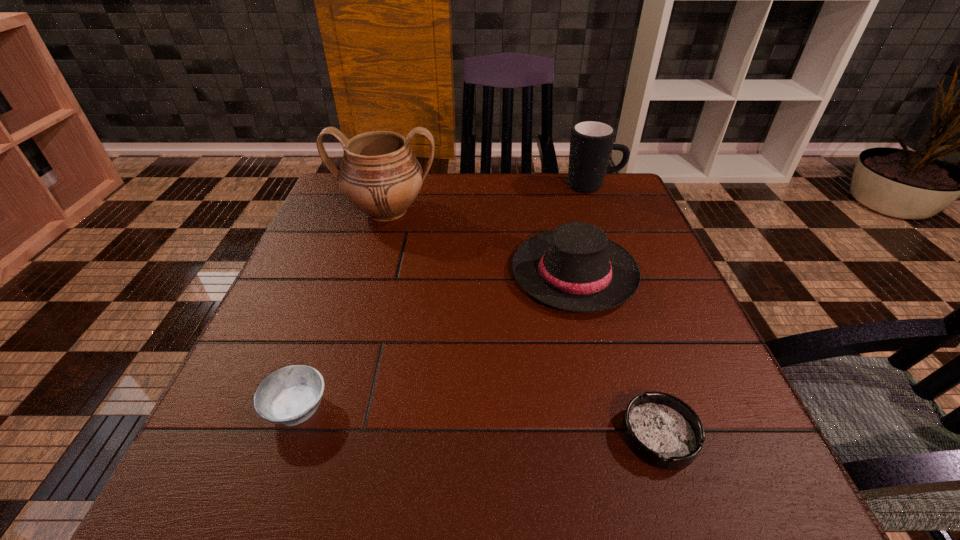
I want to click on urn, so click(379, 175).

Find the location of a particular element. The width and height of the screenshot is (960, 540). the second tallest object is located at coordinates (591, 143).

The height and width of the screenshot is (540, 960). What are the coordinates of `dress hat` in the screenshot? It's located at (576, 268).

Identify the location of the third nearest object. This screenshot has width=960, height=540. pos(576,268).

Where is `the fourth tallest object`? the fourth tallest object is located at coordinates (289, 396).

Locate an element on the screen. The image size is (960, 540). the left ashtray is located at coordinates (289, 396).

Locate an element on the screen. the right ashtray is located at coordinates (661, 429).

Where is `the shorter ashtray`? The height and width of the screenshot is (540, 960). the shorter ashtray is located at coordinates (661, 429).

Image resolution: width=960 pixels, height=540 pixels. Identify the location of vacant space located 0.130m on the front-facing side of the tallest object. (370, 268).

Identify the location of free location located on the back of the dress hat. This screenshot has width=960, height=540. (553, 189).